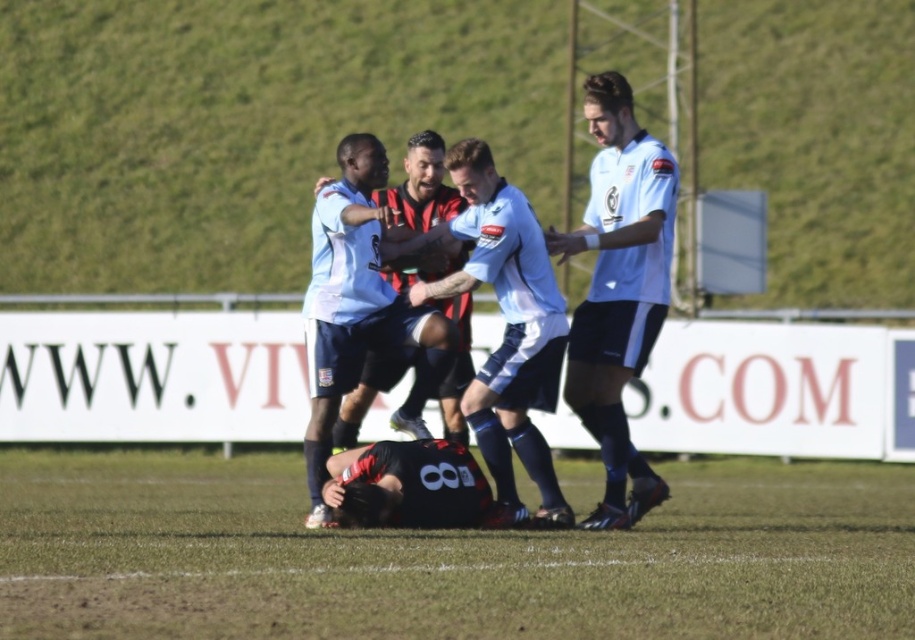
Can you confirm if light blue jersey at center is wider than reddish-brown leather jacket at center?

Correct, the width of light blue jersey at center exceeds that of reddish-brown leather jacket at center.

Can you confirm if light blue jersey at center is bigger than reddish-brown leather jacket at center?

Correct, light blue jersey at center is larger in size than reddish-brown leather jacket at center.

Where is `light blue jersey at center`? The width and height of the screenshot is (915, 640). light blue jersey at center is located at coordinates (563, 305).

Does white matte jersey at center come in front of matte black jersey at center?

That is False.

Is white matte jersey at center thinner than matte black jersey at center?

Yes, white matte jersey at center is thinner than matte black jersey at center.

Image resolution: width=915 pixels, height=640 pixels. What do you see at coordinates (619, 289) in the screenshot?
I see `white matte jersey at center` at bounding box center [619, 289].

The image size is (915, 640). I want to click on white matte jersey at center, so click(619, 289).

Consider the image. Can you confirm if white matte jersey at center is wider than reddish-brown leather jacket at center?

In fact, white matte jersey at center might be narrower than reddish-brown leather jacket at center.

Between white matte jersey at center and reddish-brown leather jacket at center, which one is positioned lower?

reddish-brown leather jacket at center is below.

The image size is (915, 640). What do you see at coordinates (619, 289) in the screenshot?
I see `white matte jersey at center` at bounding box center [619, 289].

I want to click on white matte jersey at center, so click(619, 289).